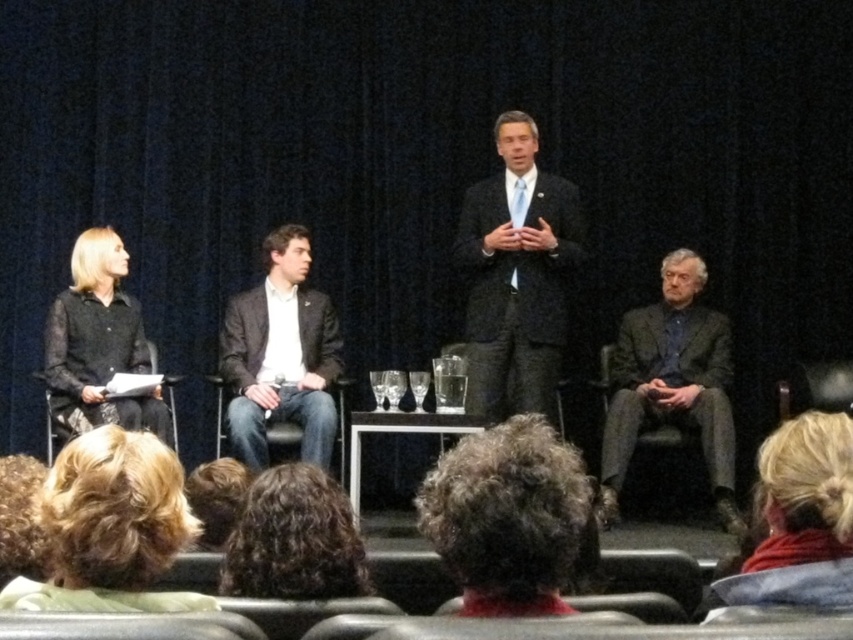
Is white shirt at center to the right of dark brown curly hair at lower center from the viewer's perspective?

No, white shirt at center is not to the right of dark brown curly hair at lower center.

Can you confirm if white shirt at center is wider than dark brown curly hair at lower center?

Yes, white shirt at center is wider than dark brown curly hair at lower center.

Between point (234, 298) and point (343, 556), which one is positioned in front?

Point (343, 556) is more forward.

At what (x,y) coordinates should I click in order to perform the action: click on white shirt at center. Please return your answer as a coordinate pair (x, y). Looking at the image, I should click on (281, 355).

Is dark gray suit at center below white shirt at center?

Actually, dark gray suit at center is above white shirt at center.

Between dark gray suit at center and white shirt at center, which one has more height?

With more height is dark gray suit at center.

Identify the location of dark gray suit at center. The height and width of the screenshot is (640, 853). (515, 275).

I want to click on dark gray suit at center, so click(x=515, y=275).

Who is more forward, (473, 579) or (788, 589)?

Point (473, 579) is more forward.

Does dark curly hair at center appear on the right side of blonde hair at lower right?

In fact, dark curly hair at center is to the left of blonde hair at lower right.

Does point (520, 552) come closer to viewer compared to point (844, 426)?

Yes, it is in front of point (844, 426).

Find the location of a particular element. This screenshot has width=853, height=640. dark curly hair at center is located at coordinates (508, 516).